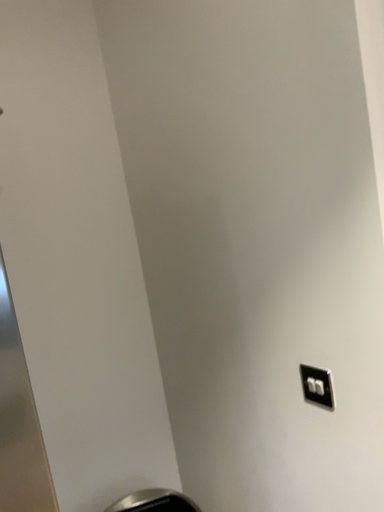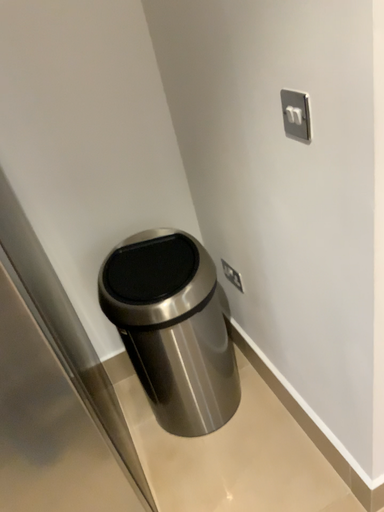
Question: How did the camera likely rotate when shooting the video?

Choices:
 (A) rotated upward
 (B) rotated downward

Answer: (B)